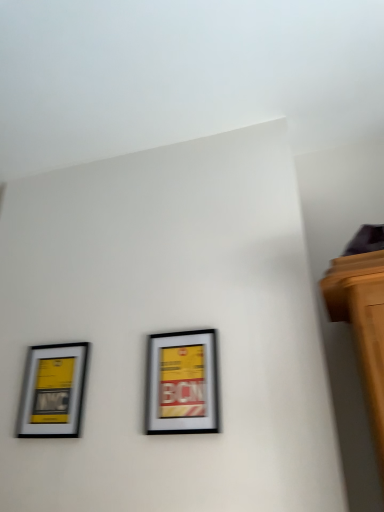
Question: From a real-world perspective, is matte black picture frame at left, arranged as the 1th picture frame when viewed from the left, above or below matte silver picture frame at center, positioned as the 1th picture frame in right-to-left order?

Choices:
 (A) below
 (B) above

Answer: (B)

Question: Considering their positions, is matte black picture frame at left, arranged as the 1th picture frame when viewed from the left, located in front of or behind matte silver picture frame at center, positioned as the 1th picture frame in right-to-left order?

Choices:
 (A) front
 (B) behind

Answer: (B)

Question: Is point (34, 408) closer or farther from the camera than point (206, 370)?

Choices:
 (A) farther
 (B) closer

Answer: (A)

Question: Would you say matte silver picture frame at center, positioned as the 1th picture frame in right-to-left order, is to the left or to the right of matte black picture frame at left, arranged as the 1th picture frame when viewed from the left, in the picture?

Choices:
 (A) left
 (B) right

Answer: (B)

Question: Is matte silver picture frame at center, which appears as the 2th picture frame when viewed from the left, in front of or behind matte black picture frame at left, arranged as the 1th picture frame when viewed from the left, in the image?

Choices:
 (A) behind
 (B) front

Answer: (B)

Question: Is matte silver picture frame at center, which appears as the 2th picture frame when viewed from the left, taller or shorter than matte black picture frame at left, the second picture frame viewed from the right?

Choices:
 (A) short
 (B) tall

Answer: (B)

Question: Do you think matte silver picture frame at center, which appears as the 2th picture frame when viewed from the left, is within matte black picture frame at left, arranged as the 1th picture frame when viewed from the left, or outside of it?

Choices:
 (A) outside
 (B) inside

Answer: (A)